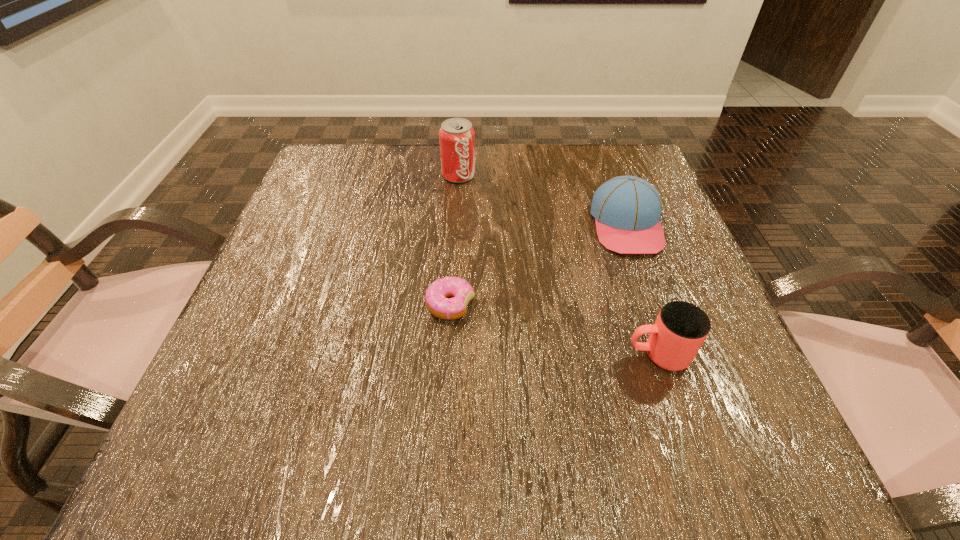
Identify the location of soda can. (457, 137).

Image resolution: width=960 pixels, height=540 pixels. Find the location of `the tallest object`. the tallest object is located at coordinates (457, 137).

Identify the location of the second farthest object. (627, 209).

In order to click on the nearest object in this screenshot , I will do `click(681, 328)`.

The image size is (960, 540). Find the location of `doughnut`. doughnut is located at coordinates (436, 300).

This screenshot has width=960, height=540. Identify the location of the shortest object. (436, 300).

I want to click on vacant space situated on the front of the farthest object, so click(457, 206).

Where is `free location located 0.120m on the front-facing side of the third nearest object`? free location located 0.120m on the front-facing side of the third nearest object is located at coordinates (656, 307).

Find the location of a particular element. free location located 0.130m on the handle side of the cup is located at coordinates (541, 354).

Identify the location of vacant space located on the handle side of the cup. (541, 354).